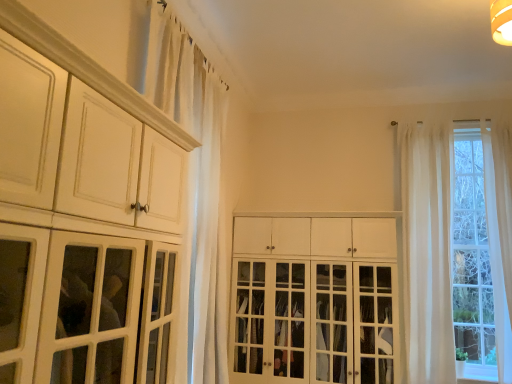
Where is `sheer white curtains at right`? sheer white curtains at right is located at coordinates (429, 250).

Where is `white sheer curtain at upper left`? Image resolution: width=512 pixels, height=384 pixels. white sheer curtain at upper left is located at coordinates (195, 180).

This screenshot has height=384, width=512. Identify the location of sheer white curtains at right. pyautogui.click(x=429, y=250).

In terms of width, does white sheer curtain at upper left look wider or thinner when compared to white wood cabinet at center, marked as the second cabinetry in a front-to-back arrangement?

In the image, white sheer curtain at upper left appears to be more narrow than white wood cabinet at center, marked as the second cabinetry in a front-to-back arrangement.

Is white sheer curtain at upper left inside or outside of white wood cabinet at center, marked as the second cabinetry in a front-to-back arrangement?

white sheer curtain at upper left exists outside the volume of white wood cabinet at center, marked as the second cabinetry in a front-to-back arrangement.

Is white sheer curtain at upper left looking in the opposite direction of white wood cabinet at center, placed as the first cabinetry when sorted from right to left?

No, white wood cabinet at center, placed as the first cabinetry when sorted from right to left, is not at the back of white sheer curtain at upper left.

Which is behind, point (415, 267) or point (272, 330)?

The point (415, 267) is farther.

From the image's perspective, which object appears higher, sheer white curtains at right or white wood cabinet at center, the first cabinetry viewed from the back?

sheer white curtains at right is shown above in the image.

Is sheer white curtains at right oriented away from white wood cabinet at center, the first cabinetry viewed from the back?

sheer white curtains at right is not turned away from white wood cabinet at center, the first cabinetry viewed from the back.

Is point (490, 234) in front of point (215, 182)?

No, (490, 234) is behind (215, 182).

In terms of width, does sheer white curtains at right look wider or thinner when compared to white sheer curtain at upper left?

sheer white curtains at right is wider than white sheer curtain at upper left.

Is sheer white curtains at right beside white sheer curtain at upper left?

There is a gap between sheer white curtains at right and white sheer curtain at upper left.

From the picture: From the image's perspective, is sheer white curtains at right above or below white sheer curtain at upper left?

From the image's perspective, sheer white curtains at right appears below white sheer curtain at upper left.

You are a GUI agent. You are given a task and a screenshot of the screen. Output one action in this format:
    pyautogui.click(x=<x>, y=<y>)
    Task: Click on the cabinetry below the matte white cabinet at left, which appears as the 2th cabinetry when viewed from the right (from a real-world perspective)
    This screenshot has width=512, height=384.
    Given the screenshot: What is the action you would take?
    pyautogui.click(x=314, y=300)

Does white wood cabinet at center, the first cabinetry viewed from the back, have a larger size compared to matte white cabinet at left, the first cabinetry from the front?

Correct, white wood cabinet at center, the first cabinetry viewed from the back, is larger in size than matte white cabinet at left, the first cabinetry from the front.

How many degrees apart are the facing directions of white wood cabinet at center, the first cabinetry viewed from the back, and matte white cabinet at left, the 1th cabinetry positioned from the left?

The facing directions of white wood cabinet at center, the first cabinetry viewed from the back, and matte white cabinet at left, the 1th cabinetry positioned from the left, are 91.2 degrees apart.

Is sheer white curtains at right oriented away from matte white cabinet at left, which appears as the 2th cabinetry when viewed from the right?

No, sheer white curtains at right is not facing the opposite direction of matte white cabinet at left, which appears as the 2th cabinetry when viewed from the right.

Is sheer white curtains at right taller than matte white cabinet at left, the first cabinetry from the front?

Correct, sheer white curtains at right is much taller as matte white cabinet at left, the first cabinetry from the front.

Locate an element on the screen. This screenshot has width=512, height=384. cabinetry that is the 2nd object to the left of the sheer white curtains at right, starting at the anchor is located at coordinates (81, 156).

Is sheer white curtains at right bigger than matte white cabinet at left, arranged as the 2th cabinetry when viewed from the back?

No.

Considering the relative positions of white sheer curtain at upper left and matte white cabinet at left, the 1th cabinetry positioned from the left, in the image provided, is white sheer curtain at upper left to the left of matte white cabinet at left, the 1th cabinetry positioned from the left, from the viewer's perspective?

No, white sheer curtain at upper left is not to the left of matte white cabinet at left, the 1th cabinetry positioned from the left.

Which is nearer, (179, 41) or (68, 305)?

The point (68, 305) is closer.

Looking at their sizes, would you say white sheer curtain at upper left is wider or thinner than matte white cabinet at left, which appears as the 2th cabinetry when viewed from the right?

Considering their sizes, white sheer curtain at upper left looks slimmer than matte white cabinet at left, which appears as the 2th cabinetry when viewed from the right.

Find the location of a particular element. The height and width of the screenshot is (384, 512). curtain located above the matte white cabinet at left, the 1th cabinetry positioned from the left (from the image's perspective) is located at coordinates (195, 180).

The height and width of the screenshot is (384, 512). Identify the location of curtain above the white wood cabinet at center, the 2th cabinetry from the left (from a real-world perspective). (195, 180).

What's the angular difference between white wood cabinet at center, marked as the second cabinetry in a front-to-back arrangement, and white sheer curtain at upper left's facing directions?

The angle between the facing direction of white wood cabinet at center, marked as the second cabinetry in a front-to-back arrangement, and the facing direction of white sheer curtain at upper left is 91.2 degrees.

Is white sheer curtain at upper left located within white wood cabinet at center, the 2th cabinetry from the left?

No, white sheer curtain at upper left is not inside white wood cabinet at center, the 2th cabinetry from the left.

From the image's perspective, starting from the white sheer curtain at upper left, which cabinetry is the 2nd one below? Please provide its 2D coordinates.

[(314, 300)]

The width and height of the screenshot is (512, 384). I want to click on the 2nd cabinetry below the sheer white curtains at right (from a real-world perspective), so click(314, 300).

Looking at the image, which one is located closer to sheer white curtains at right, white wood cabinet at center, marked as the second cabinetry in a front-to-back arrangement, or matte white cabinet at left, which appears as the 2th cabinetry when viewed from the right?

The object closer to sheer white curtains at right is white wood cabinet at center, marked as the second cabinetry in a front-to-back arrangement.

Considering their positions, is sheer white curtains at right positioned further to white wood cabinet at center, the 2th cabinetry from the left, than matte white cabinet at left, the 1th cabinetry positioned from the left?

matte white cabinet at left, the 1th cabinetry positioned from the left, is further to white wood cabinet at center, the 2th cabinetry from the left.

Looking at the image, which one is located further to white wood cabinet at center, placed as the first cabinetry when sorted from right to left, white sheer curtain at upper left or sheer white curtains at right?

The object further to white wood cabinet at center, placed as the first cabinetry when sorted from right to left, is white sheer curtain at upper left.

When comparing their distances from matte white cabinet at left, which appears as the 2th cabinetry when viewed from the right, does white wood cabinet at center, the first cabinetry viewed from the back, or sheer white curtains at right seem closer?

white wood cabinet at center, the first cabinetry viewed from the back.

Which object lies further to the anchor point white wood cabinet at center, the first cabinetry viewed from the back, matte white cabinet at left, the 1th cabinetry positioned from the left, or sheer white curtains at right?

The object further to white wood cabinet at center, the first cabinetry viewed from the back, is matte white cabinet at left, the 1th cabinetry positioned from the left.

From the image, which object appears to be nearer to white sheer curtain at upper left, white wood cabinet at center, the 2th cabinetry from the left, or sheer white curtains at right?

Based on the image, white wood cabinet at center, the 2th cabinetry from the left, appears to be nearer to white sheer curtain at upper left.

Considering their positions, is white sheer curtain at upper left positioned closer to white wood cabinet at center, the first cabinetry viewed from the back, than matte white cabinet at left, the 1th cabinetry positioned from the left?

white sheer curtain at upper left.

Estimate the real-world distances between objects in this image. Which object is further from matte white cabinet at left, the 1th cabinetry positioned from the left, white sheer curtain at upper left or white wood cabinet at center, placed as the first cabinetry when sorted from right to left?

white wood cabinet at center, placed as the first cabinetry when sorted from right to left, lies further to matte white cabinet at left, the 1th cabinetry positioned from the left, than the other object.

You are a GUI agent. You are given a task and a screenshot of the screen. Output one action in this format:
    pyautogui.click(x=<x>, y=<y>)
    Task: Click on the cabinetry between white sheer curtain at upper left and sheer white curtains at right from left to right
    This screenshot has height=384, width=512.
    Given the screenshot: What is the action you would take?
    pyautogui.click(x=314, y=300)

At what (x,y) coordinates should I click in order to perform the action: click on curtain between matte white cabinet at left, arranged as the 2th cabinetry when viewed from the back, and white wood cabinet at center, the 2th cabinetry from the left, in the front-back direction. Please return your answer as a coordinate pair (x, y). Image resolution: width=512 pixels, height=384 pixels. Looking at the image, I should click on [195, 180].

The height and width of the screenshot is (384, 512). Identify the location of curtain between matte white cabinet at left, which appears as the 2th cabinetry when viewed from the right, and sheer white curtains at right in the front-back direction. (195, 180).

This screenshot has height=384, width=512. Find the location of `cabinetry located between matte white cabinet at left, arranged as the 2th cabinetry when viewed from the back, and sheer white curtains at right in the depth direction`. cabinetry located between matte white cabinet at left, arranged as the 2th cabinetry when viewed from the back, and sheer white curtains at right in the depth direction is located at coordinates (314, 300).